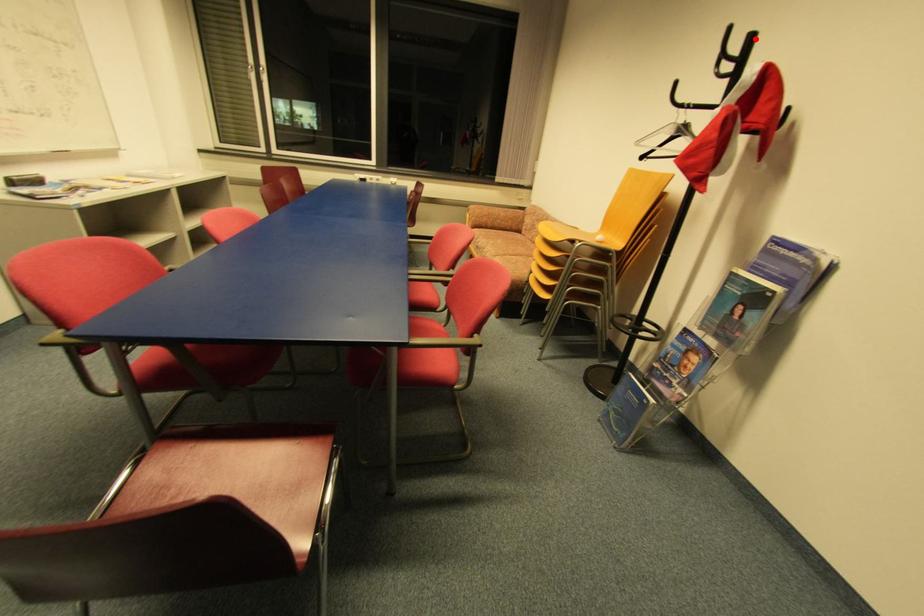
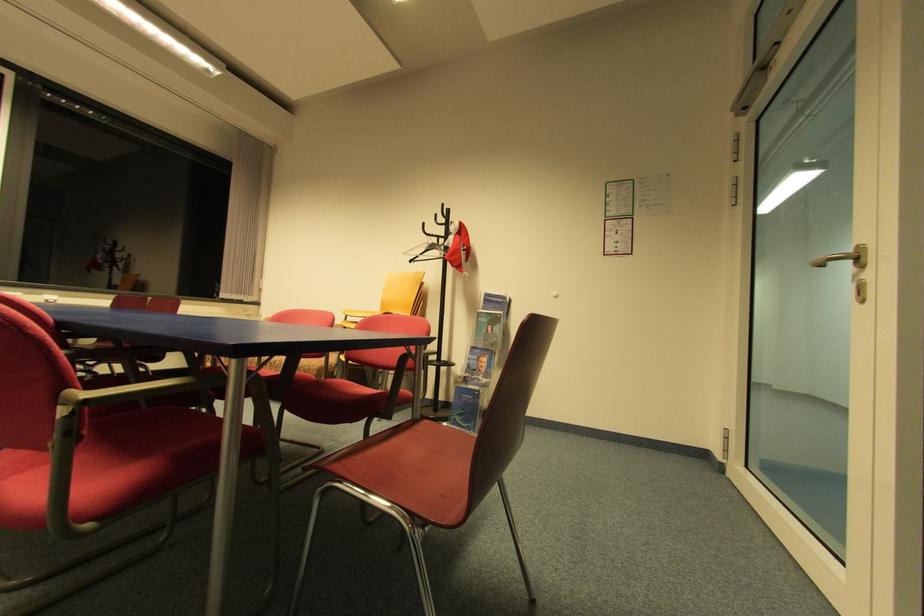
Where in the second image is the point corresponding to the highlighted location from the first image?

(453, 212)